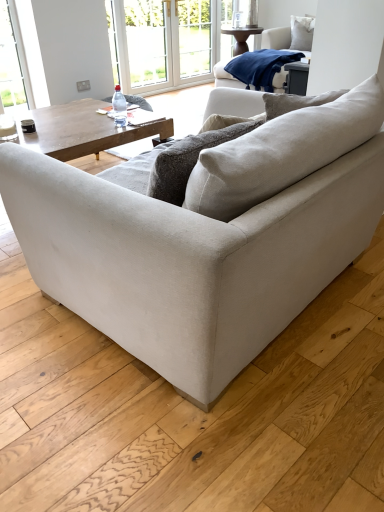
Question: From a real-world perspective, is white glossy coffee cup at upper left beneath transparent plastic bottle at center?

Choices:
 (A) no
 (B) yes

Answer: (B)

Question: From the image's perspective, does white glossy coffee cup at upper left appear higher than transparent plastic bottle at center?

Choices:
 (A) no
 (B) yes

Answer: (A)

Question: From a real-world perspective, is white glossy coffee cup at upper left on transparent plastic bottle at center?

Choices:
 (A) no
 (B) yes

Answer: (A)

Question: Can you confirm if white glossy coffee cup at upper left is bigger than transparent plastic bottle at center?

Choices:
 (A) yes
 (B) no

Answer: (A)

Question: Is white glossy coffee cup at upper left in front of transparent plastic bottle at center?

Choices:
 (A) yes
 (B) no

Answer: (A)

Question: Are white glossy coffee cup at upper left and transparent plastic bottle at center making contact?

Choices:
 (A) yes
 (B) no

Answer: (B)

Question: From the image's perspective, is white soft cushion at upper right below white plastic window frame at upper center?

Choices:
 (A) yes
 (B) no

Answer: (B)

Question: From a real-world perspective, is white soft cushion at upper right located higher than white plastic window frame at upper center?

Choices:
 (A) no
 (B) yes

Answer: (B)

Question: Can you confirm if white soft cushion at upper right is thinner than white plastic window frame at upper center?

Choices:
 (A) no
 (B) yes

Answer: (A)

Question: From a real-world perspective, is white soft cushion at upper right physically below white plastic window frame at upper center?

Choices:
 (A) yes
 (B) no

Answer: (B)

Question: Is white soft cushion at upper right not near white plastic window frame at upper center?

Choices:
 (A) no
 (B) yes

Answer: (B)

Question: Is white soft cushion at upper right facing away from white plastic window frame at upper center?

Choices:
 (A) yes
 (B) no

Answer: (B)

Question: Is transparent plastic window screen at upper center shorter than navy blue fleece blanket at upper right?

Choices:
 (A) yes
 (B) no

Answer: (B)